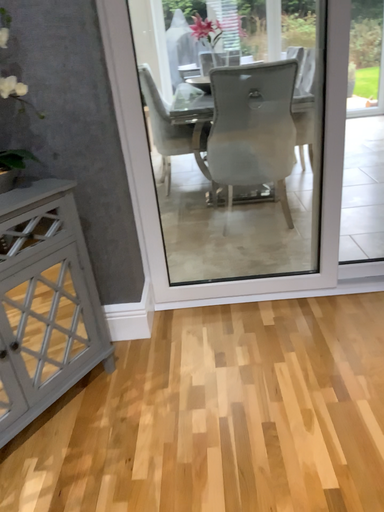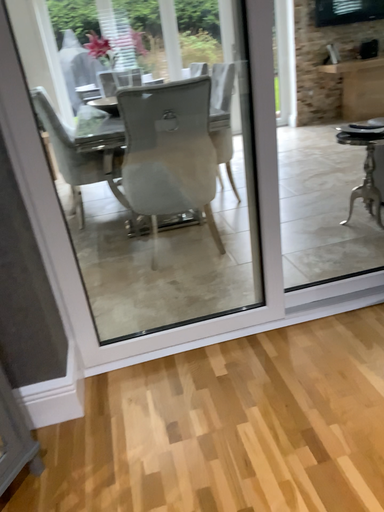
Question: Which way did the camera rotate in the video?

Choices:
 (A) rotated left
 (B) rotated right

Answer: (B)